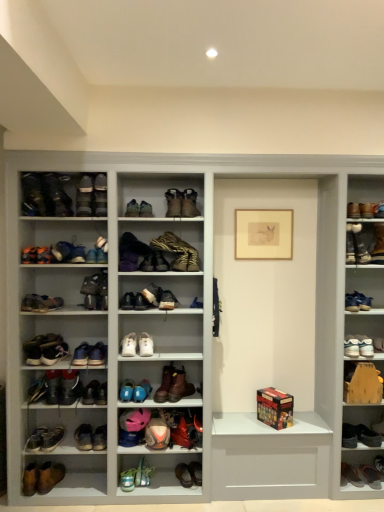
The width and height of the screenshot is (384, 512). What are the coordinates of `vacant position to the left of brown suede boot at lower right, marked as the 31th footwear in a left-to-right arrangement` in the screenshot? It's located at (350, 484).